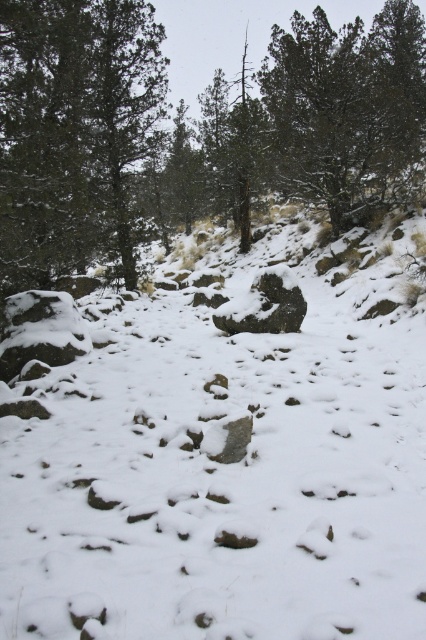
Which of these two, green matte tree at upper left or dark green textured tree at upper right, stands shorter?

Standing shorter between the two is green matte tree at upper left.

Find the location of a particular element. The image size is (426, 640). green matte tree at upper left is located at coordinates (74, 132).

Is point (103, 205) more distant than point (340, 92)?

No, it is in front of (340, 92).

The height and width of the screenshot is (640, 426). Identify the location of green matte tree at upper left. (74, 132).

Is dark green textured tree at upper right bigger than dark gray rock at center?

Correct, dark green textured tree at upper right is larger in size than dark gray rock at center.

Which is more to the right, dark green textured tree at upper right or dark gray rock at center?

From the viewer's perspective, dark green textured tree at upper right appears more on the right side.

Which is in front, point (354, 136) or point (218, 316)?

Positioned in front is point (218, 316).

What are the coordinates of `dark green textured tree at upper right` in the screenshot? It's located at (348, 109).

Between white powdery snow at center and dark green textured tree at upper right, which one is positioned lower?

Positioned lower is white powdery snow at center.

Who is more distant from viewer, (29, 422) or (394, 83)?

Positioned behind is point (394, 83).

Which is in front, point (388, 429) or point (353, 22)?

Point (388, 429) is in front.

This screenshot has width=426, height=640. In order to click on white powdery snow at center in this screenshot , I will do `click(224, 458)`.